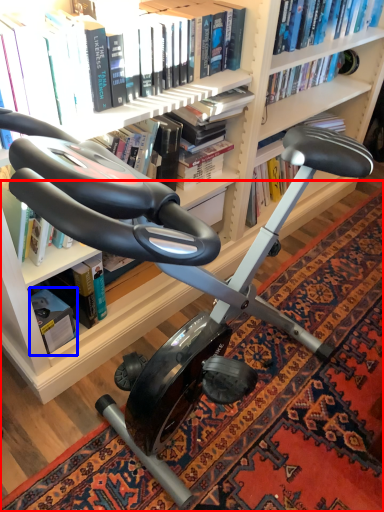
Question: Which object appears farthest to the camera in this image, mat (highlighted by a red box) or paperback book (highlighted by a blue box)?

Choices:
 (A) mat
 (B) paperback book

Answer: (B)